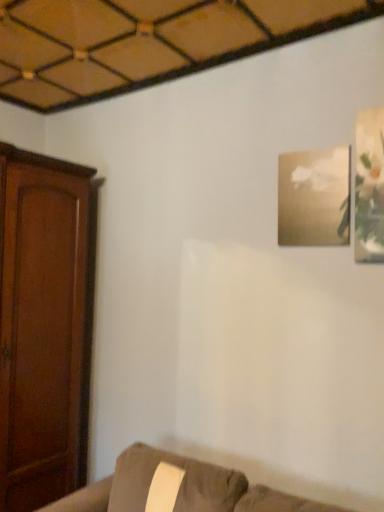
Question: Is suede couch at lower right taller than matte white frame at upper right, which is the first picture frame in right-to-left order?

Choices:
 (A) yes
 (B) no

Answer: (B)

Question: From the image's perspective, is suede couch at lower right below matte white frame at upper right, which is the first picture frame in right-to-left order?

Choices:
 (A) yes
 (B) no

Answer: (A)

Question: From a real-world perspective, is suede couch at lower right under matte white frame at upper right, which is the first picture frame in right-to-left order?

Choices:
 (A) no
 (B) yes

Answer: (B)

Question: Does suede couch at lower right have a greater width compared to matte white frame at upper right, which is the first picture frame in right-to-left order?

Choices:
 (A) no
 (B) yes

Answer: (B)

Question: Is the depth of suede couch at lower right greater than that of matte white frame at upper right, the 2th picture frame viewed from the back?

Choices:
 (A) yes
 (B) no

Answer: (B)

Question: Which is correct: gold textured frame at upper right, positioned as the second picture frame in front-to-back order, is inside suede couch at lower right, or outside of it?

Choices:
 (A) inside
 (B) outside

Answer: (B)

Question: Looking at their shapes, would you say gold textured frame at upper right, placed as the first picture frame when sorted from back to front, is wider or thinner than suede couch at lower right?

Choices:
 (A) wide
 (B) thin

Answer: (B)

Question: In terms of size, does gold textured frame at upper right, positioned as the second picture frame in front-to-back order, appear bigger or smaller than suede couch at lower right?

Choices:
 (A) small
 (B) big

Answer: (A)

Question: Is point (314, 194) closer or farther from the camera than point (144, 475)?

Choices:
 (A) closer
 (B) farther

Answer: (A)

Question: From their relative heights in the image, would you say matte white frame at upper right, which ranks as the 2th picture frame in left-to-right order, is taller or shorter than gold textured frame at upper right, positioned as the second picture frame in front-to-back order?

Choices:
 (A) tall
 (B) short

Answer: (A)

Question: From a real-world perspective, relative to gold textured frame at upper right, the second picture frame in the right-to-left sequence, is matte white frame at upper right, the 2th picture frame viewed from the back, vertically above or below?

Choices:
 (A) below
 (B) above

Answer: (B)

Question: Do you think matte white frame at upper right, which ranks as the 2th picture frame in left-to-right order, is within gold textured frame at upper right, positioned as the second picture frame in front-to-back order, or outside of it?

Choices:
 (A) inside
 (B) outside

Answer: (B)

Question: Considering their positions, is matte white frame at upper right, which ranks as the 2th picture frame in left-to-right order, located in front of or behind gold textured frame at upper right, the second picture frame in the right-to-left sequence?

Choices:
 (A) front
 (B) behind

Answer: (A)

Question: Is gold textured frame at upper right, the second picture frame in the right-to-left sequence, bigger or smaller than matte white frame at upper right, positioned as the first picture frame in front-to-back order?

Choices:
 (A) big
 (B) small

Answer: (A)

Question: In the image, is gold textured frame at upper right, positioned as the second picture frame in front-to-back order, positioned in front of or behind matte white frame at upper right, which is the first picture frame in right-to-left order?

Choices:
 (A) behind
 (B) front

Answer: (A)